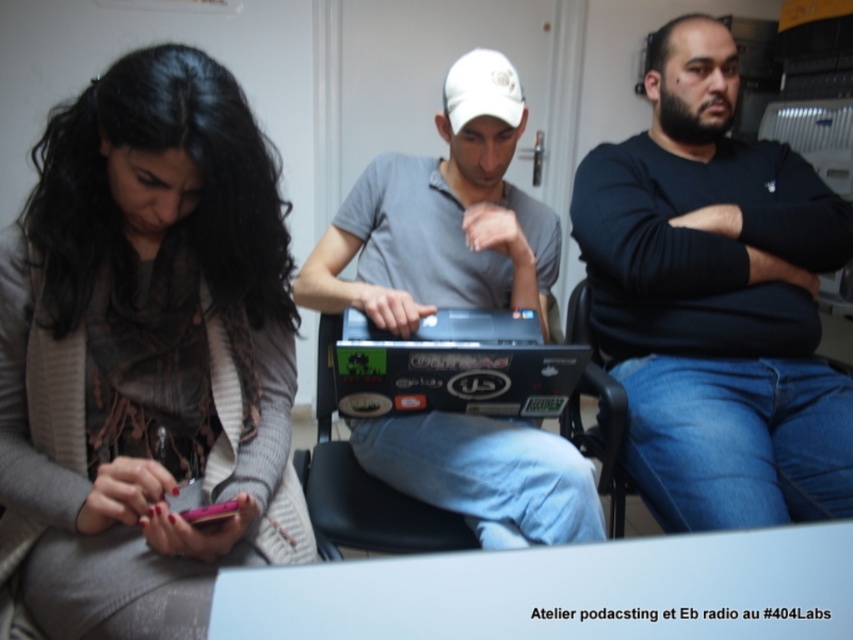
Question: Which object is positioned closest to the black matte shirt at center?

Choices:
 (A) matte pink phone at lower left
 (B) black plastic chair at center

Answer: (B)

Question: Among these objects, which one is farthest from the camera?

Choices:
 (A) black plastic chair at center
 (B) gray matte shirt at center
 (C) matte pink phone at lower left
 (D) black matte shirt at center

Answer: (A)

Question: Is gray matte shirt at center above black plastic chair at center?

Choices:
 (A) yes
 (B) no

Answer: (A)

Question: Is the position of matte pink phone at lower left less distant than that of gray matte shirt at center?

Choices:
 (A) no
 (B) yes

Answer: (B)

Question: Which of the following is the closest to the observer?

Choices:
 (A) black matte shirt at center
 (B) black plastic chair at center
 (C) gray matte shirt at center

Answer: (C)

Question: Is matte pink phone at lower left positioned behind black matte shirt at center?

Choices:
 (A) yes
 (B) no

Answer: (B)